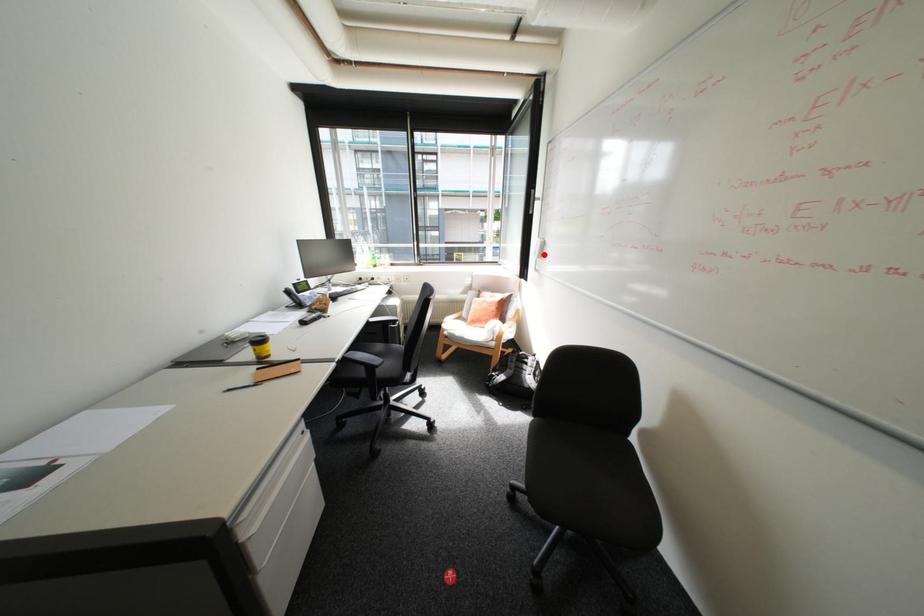
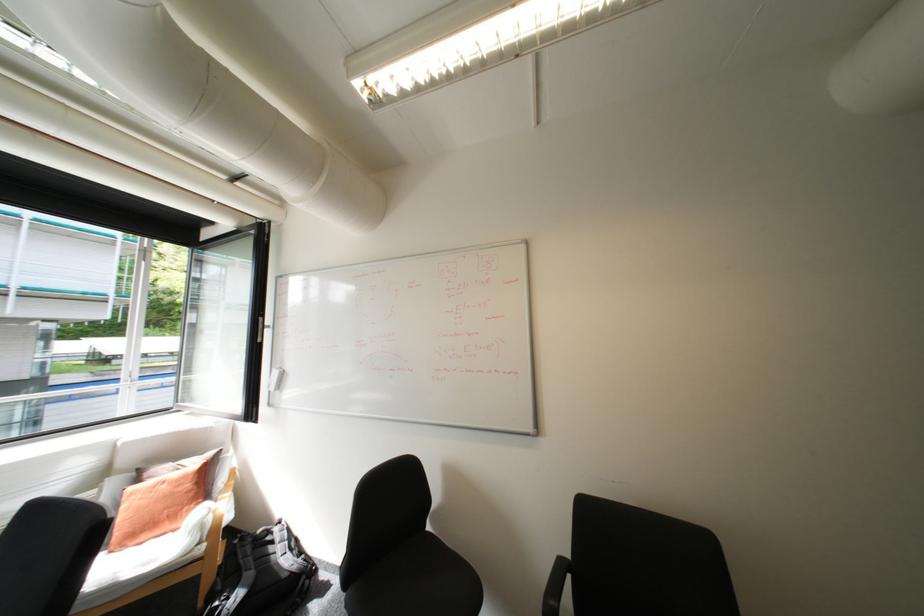
Where in the second image is the point corresponding to the highlighted location from the first image?

(277, 387)